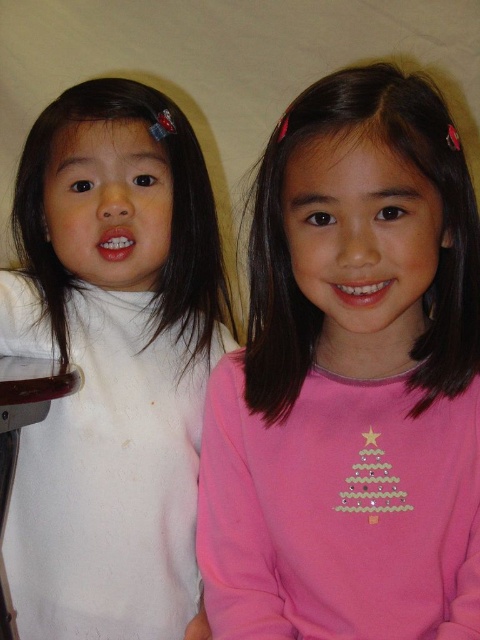
Can you confirm if pink matte shirt at center is positioned to the right of white soft sweater at left?

Yes, pink matte shirt at center is to the right of white soft sweater at left.

Can you confirm if pink matte shirt at center is smaller than white soft sweater at left?

Correct, pink matte shirt at center occupies less space than white soft sweater at left.

Image resolution: width=480 pixels, height=640 pixels. What are the coordinates of `pink matte shirt at center` in the screenshot? It's located at (350, 380).